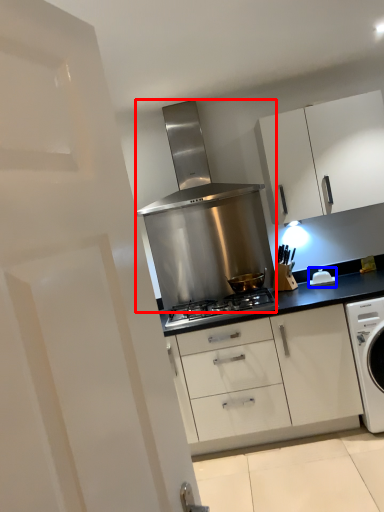
Question: Which object is further to the camera taking this photo, home appliance (highlighted by a red box) or appliance (highlighted by a blue box)?

Choices:
 (A) home appliance
 (B) appliance

Answer: (A)